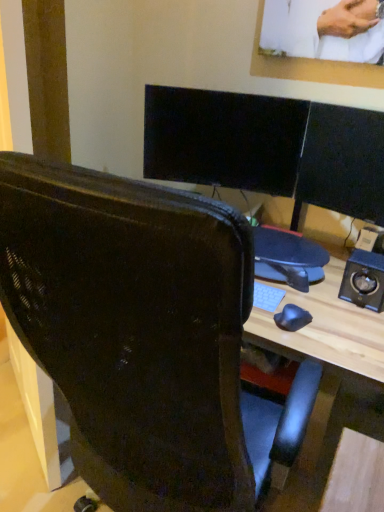
In order to face metallic black speaker at right, should I rotate leftwards or rightwards?

To face it directly, rotate right by 22.054 degrees.

The width and height of the screenshot is (384, 512). Find the location of `metallic black speaker at right`. metallic black speaker at right is located at coordinates (364, 280).

The height and width of the screenshot is (512, 384). What do you see at coordinates (364, 280) in the screenshot?
I see `metallic black speaker at right` at bounding box center [364, 280].

Where is `matte black chair at center`? matte black chair at center is located at coordinates (144, 336).

What do you see at coordinates (144, 336) in the screenshot? The width and height of the screenshot is (384, 512). I see `matte black chair at center` at bounding box center [144, 336].

Find the location of `metallic black speaker at right`. metallic black speaker at right is located at coordinates (364, 280).

Is matte black chair at center to the right of metallic black speaker at right from the viewer's perspective?

Incorrect, matte black chair at center is not on the right side of metallic black speaker at right.

Relative to metallic black speaker at right, is matte black chair at center in front or behind?

In the image, matte black chair at center appears in front of metallic black speaker at right.

Is point (69, 333) positioned behind point (352, 261)?

No, it is not.

From the image's perspective, does matte black chair at center appear higher than metallic black speaker at right?

No, from the image's perspective, matte black chair at center is not above metallic black speaker at right.

From a real-world perspective, between matte black chair at center and metallic black speaker at right, who is vertically higher?

metallic black speaker at right, from a real-world perspective.

Consider the image. Which object is wider, matte black chair at center or metallic black speaker at right?

matte black chair at center.

Considering the relative sizes of matte black chair at center and metallic black speaker at right in the image provided, is matte black chair at center shorter than metallic black speaker at right?

No.

Which of these two, matte black chair at center or metallic black speaker at right, is bigger?

Bigger between the two is matte black chair at center.

Could metallic black speaker at right be considered to be inside matte black chair at center?

No, metallic black speaker at right is located outside of matte black chair at center.

Are matte black chair at center and metallic black speaker at right beside each other?

No, matte black chair at center is not next to metallic black speaker at right.

Is matte black chair at center aimed at metallic black speaker at right?

Yes, matte black chair at center is facing metallic black speaker at right.

At what (x,y) coordinates should I click in order to perform the action: click on speaker behind the matte black chair at center. Please return your answer as a coordinate pair (x, y). The height and width of the screenshot is (512, 384). Looking at the image, I should click on pos(364,280).

Based on their positions, is metallic black speaker at right located to the left or right of matte black chair at center?

Based on their positions, metallic black speaker at right is located to the right of matte black chair at center.

Is the depth of metallic black speaker at right greater than that of matte black chair at center?

Yes, the depth of metallic black speaker at right is greater than that of matte black chair at center.

Which is in front, point (359, 270) or point (30, 166)?

The point (30, 166) is closer to the camera.

From the image's perspective, between metallic black speaker at right and matte black chair at center, who is located below?

matte black chair at center.

From a real-world perspective, is metallic black speaker at right positioned over matte black chair at center based on gravity?

Yes, from a real-world perspective, metallic black speaker at right is above matte black chair at center.

In the scene shown: Which object is thinner, metallic black speaker at right or matte black chair at center?

With smaller width is metallic black speaker at right.

Who is shorter, metallic black speaker at right or matte black chair at center?

metallic black speaker at right is shorter.

Can you confirm if metallic black speaker at right is smaller than matte black chair at center?

Indeed, metallic black speaker at right has a smaller size compared to matte black chair at center.

Is metallic black speaker at right completely or partially outside of matte black chair at center?

Yes, metallic black speaker at right is not within matte black chair at center.

Is metallic black speaker at right far away from matte black chair at center?

No, metallic black speaker at right is not far from matte black chair at center.

Is metallic black speaker at right oriented away from matte black chair at center?

No, metallic black speaker at right is not facing the opposite direction of matte black chair at center.

Can you tell me how much metallic black speaker at right and matte black chair at center differ in facing direction?

The angle between the facing direction of metallic black speaker at right and the facing direction of matte black chair at center is 170 degrees.

At what (x,y) coordinates should I click in order to perform the action: click on speaker on the right of matte black chair at center. Please return your answer as a coordinate pair (x, y). The width and height of the screenshot is (384, 512). Looking at the image, I should click on (364, 280).

Where is `chair on the left of metallic black speaker at right`? Image resolution: width=384 pixels, height=512 pixels. chair on the left of metallic black speaker at right is located at coordinates (144, 336).

You are a GUI agent. You are given a task and a screenshot of the screen. Output one action in this format:
    pyautogui.click(x=<x>, y=<y>)
    Task: Click on the chair in front of the metallic black speaker at right
    The width and height of the screenshot is (384, 512).
    Given the screenshot: What is the action you would take?
    [x=144, y=336]